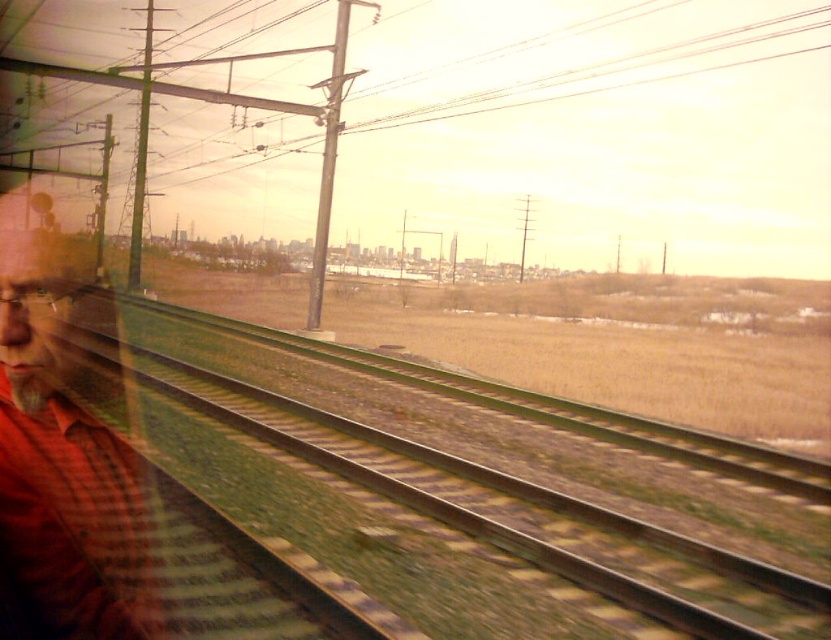
Question: Is green metallic track at center closer to camera compared to red plaid shirt at left?

Choices:
 (A) no
 (B) yes

Answer: (A)

Question: Which of the following is the farthest from the observer?

Choices:
 (A) (153, 577)
 (B) (300, 448)

Answer: (B)

Question: Where is green metallic track at center located in relation to red plaid shirt at left in the image?

Choices:
 (A) right
 (B) left

Answer: (A)

Question: Which object appears closest to the camera in this image?

Choices:
 (A) green metallic track at center
 (B) red plaid shirt at left

Answer: (B)

Question: Can you confirm if green metallic track at center is thinner than red plaid shirt at left?

Choices:
 (A) yes
 (B) no

Answer: (A)

Question: Among these points, which one is nearest to the camera?

Choices:
 (A) (32, 252)
 (B) (817, 634)

Answer: (B)